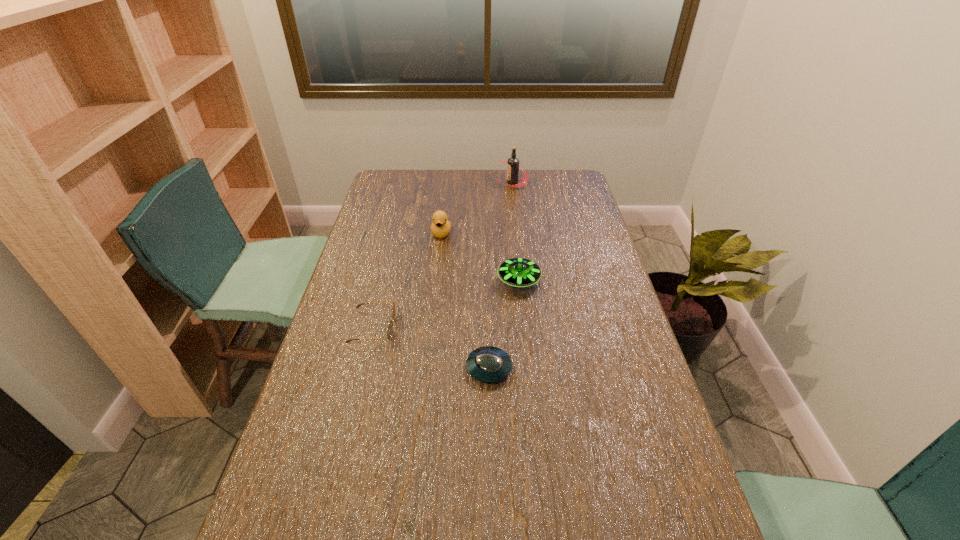
Identify the location of vacant space at the left edge of the desktop. (376, 224).

You are a GUI agent. You are given a task and a screenshot of the screen. Output one action in this format:
    pyautogui.click(x=<x>, y=<y>)
    Task: Click on the vacant space at the right edge
    
    Given the screenshot: What is the action you would take?
    pyautogui.click(x=601, y=430)

Where is `unoccupied area between the leftmost object and the nearest object`? The image size is (960, 540). unoccupied area between the leftmost object and the nearest object is located at coordinates (431, 348).

Locate an element on the screen. vacant area that lies between the sunglasses and the root beer is located at coordinates (443, 255).

Locate an element on the screen. Image resolution: width=960 pixels, height=540 pixels. vacant space that's between the root beer and the farther saucer is located at coordinates (516, 231).

At what (x,y) coordinates should I click in order to perform the action: click on vacant region between the farther saucer and the shorter saucer. Please return your answer as a coordinate pair (x, y). This screenshot has height=540, width=960. Looking at the image, I should click on (504, 324).

The height and width of the screenshot is (540, 960). I want to click on empty location between the nearest object and the fourth object from right to left, so click(466, 300).

Image resolution: width=960 pixels, height=540 pixels. I want to click on free space that is in between the shortest object and the third farthest object, so click(x=504, y=324).

Locate an element on the screen. This screenshot has height=540, width=960. object that can be found as the closest to the sunglasses is located at coordinates (488, 364).

Identify which object is the closest to the second tallest object. Please provide its 2D coordinates. Your answer should be formatted as a tuple, i.e. [(x, y)], where the tuple contains the x and y coordinates of a point satisfying the conditions above.

[(518, 272)]